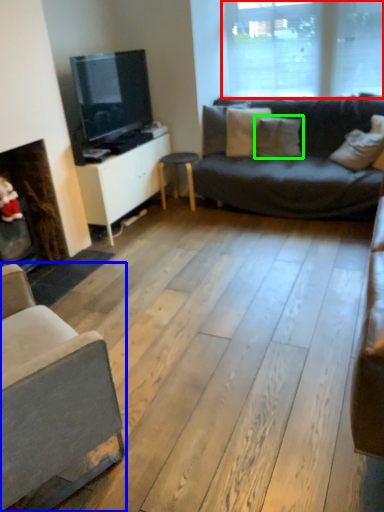
Question: Based on their relative distances, which object is nearer to window (highlighted by a red box)? Choose from studio couch (highlighted by a blue box) and pillow (highlighted by a green box).

Choices:
 (A) studio couch
 (B) pillow

Answer: (B)